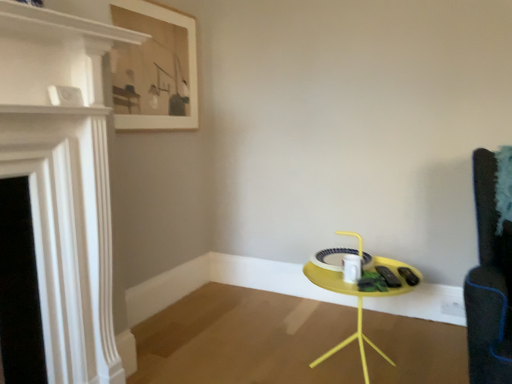
At what (x,y) coordinates should I click in order to perform the action: click on free space above wooden framed artwork at upper left (from a real-world perspective). Please return your answer as a coordinate pair (x, y). The height and width of the screenshot is (384, 512). Looking at the image, I should click on (164, 8).